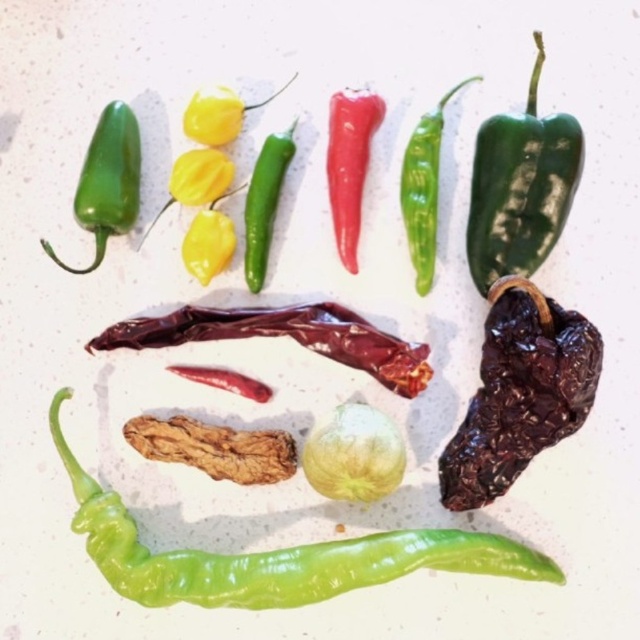
Is dry wrinkled chili pepper at center behind green glossy pepper at upper center?

That is False.

Which of these two, dry wrinkled chili pepper at center or green glossy pepper at upper center, stands taller?

green glossy pepper at upper center

Is point (428, 368) farther from viewer compared to point (408, 184)?

That is False.

Where is `dry wrinkled chili pepper at center`? The width and height of the screenshot is (640, 640). dry wrinkled chili pepper at center is located at coordinates (284, 333).

Looking at this image, does green glossy pepper at lower center have a lesser width compared to green glossy chili pepper at left?

No, green glossy pepper at lower center is not thinner than green glossy chili pepper at left.

Is green glossy pepper at lower center below green glossy chili pepper at left?

Correct, green glossy pepper at lower center is located below green glossy chili pepper at left.

Find the location of a particular element. Image resolution: width=640 pixels, height=640 pixels. green glossy pepper at lower center is located at coordinates (275, 556).

Does brown wrinkled pepper at center have a lesser height compared to green glossy chili pepper at center?

Correct, brown wrinkled pepper at center is not as tall as green glossy chili pepper at center.

Does brown wrinkled pepper at center have a lesser width compared to green glossy chili pepper at center?

Incorrect, brown wrinkled pepper at center's width is not less than green glossy chili pepper at center's.

Does point (144, 433) come farther from viewer compared to point (266, 195)?

No, it is not.

Where is `brown wrinkled pepper at center`? The image size is (640, 640). brown wrinkled pepper at center is located at coordinates (214, 449).